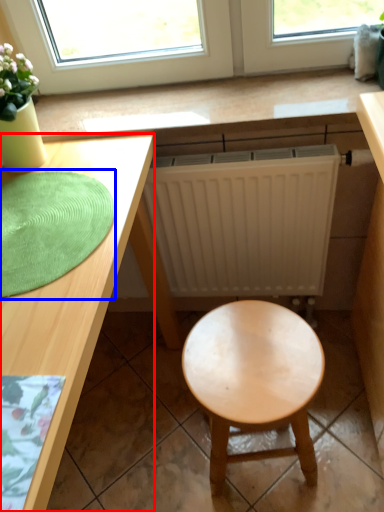
Question: Which of the following is the closest to the observer, desk (highlighted by a red box) or mat (highlighted by a blue box)?

Choices:
 (A) desk
 (B) mat

Answer: (A)